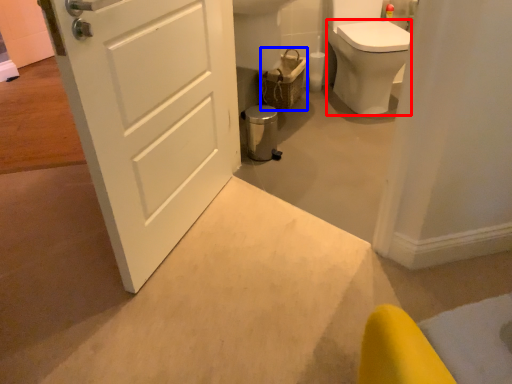
Question: Among these objects, which one is nearest to the camera, bidet (highlighted by a red box) or basket (highlighted by a blue box)?

Choices:
 (A) bidet
 (B) basket

Answer: (A)